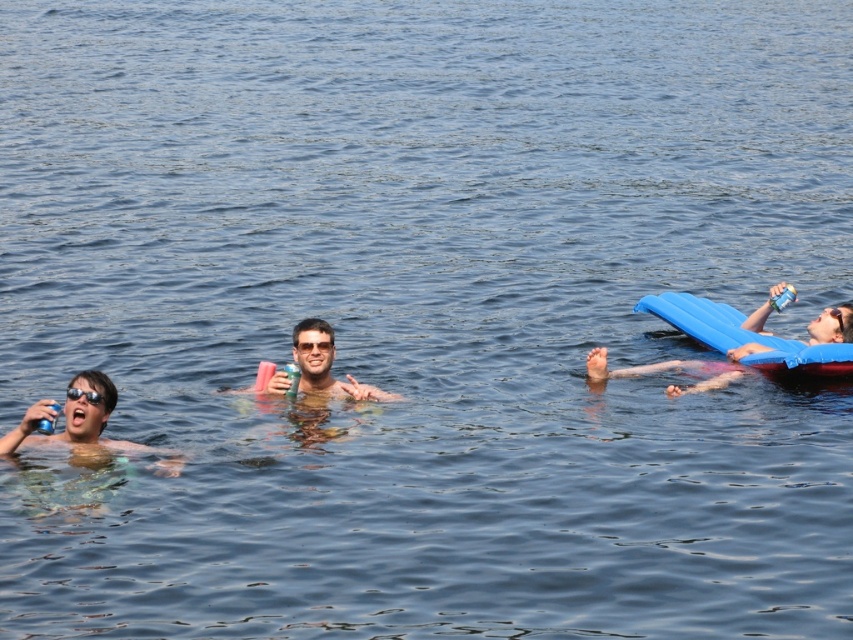
You are on a boat and want to reach the blue foam mattress at right and the matte plastic can at center. Which object can you grab first without moving your position?

The blue foam mattress at right can be grabbed first because it is closer to you than the matte plastic can at center.

You are planning to float on the water using either the blue foam mattress at right or the matte plastic can at center. Which one would provide more buoyancy based on their sizes?

The blue foam mattress at right is bigger than the matte plastic can at center, so it would provide more buoyancy.